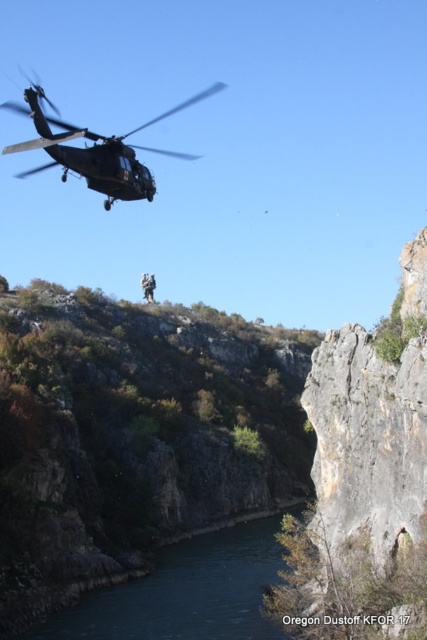
You are a drone operator trying to capture a photo of the camouflage fabric soldier at upper center and the green leafy hillside at upper center. From your current position, which object is positioned lower in the frame?

The green leafy hillside at upper center is positioned lower than the camouflage fabric soldier at upper center.

You are a drone operator trying to capture a clear aerial photo of both the green leafy hillside at upper center and the camouflage fabric soldier at upper center. Based on their positions, which object should you focus on first to ensure both are in frame?

The green leafy hillside at upper center is in front of the camouflage fabric soldier at upper center, so you should focus on the camouflage fabric soldier at upper center first to ensure both are visible in the frame.

You are a drone operator planning to fly a drone from the blue smooth water at lower center to the matte black helicopter at upper left. What is the minimum distance you need to cover?

The minimum distance you need to cover is 217.66 feet between the blue smooth water at lower center and the matte black helicopter at upper left.